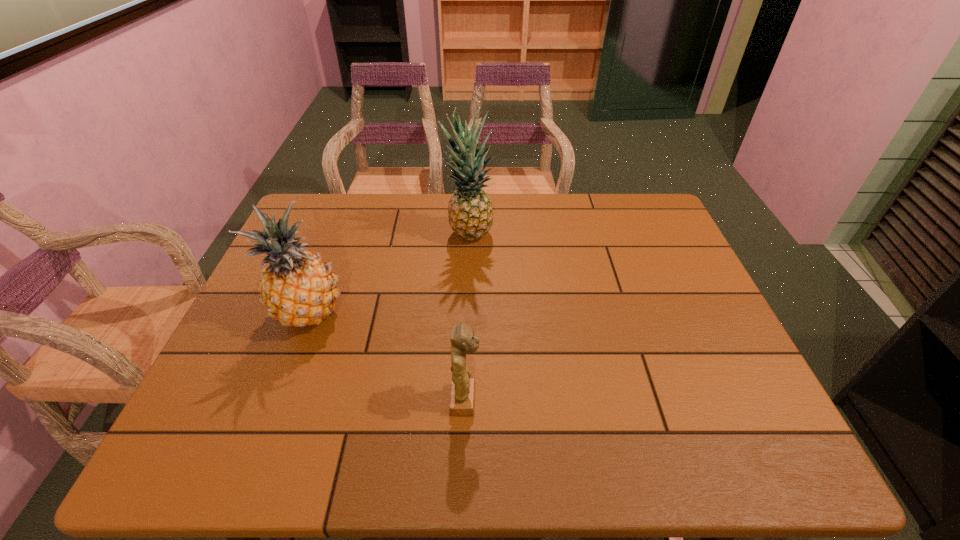
In order to click on free space between the left pineapple and the tallest object in this screenshot , I will do `click(388, 274)`.

Locate an element on the screen. This screenshot has height=540, width=960. free spot between the second nearest object and the nearest object is located at coordinates (386, 356).

Locate an element on the screen. vacant area that lies between the farthest object and the shorter pineapple is located at coordinates (388, 274).

Image resolution: width=960 pixels, height=540 pixels. Identify the location of free space between the right pineapple and the left pineapple. (388, 274).

I want to click on vacant space in between the nearer pineapple and the farther pineapple, so click(x=388, y=274).

Locate which object ranks second in proximity to the nearest object. Please provide its 2D coordinates. Your answer should be formatted as a tuple, i.e. [(x, y)], where the tuple contains the x and y coordinates of a point satisfying the conditions above.

[(470, 213)]

Locate which object is the second closest to the tallest object. Please provide its 2D coordinates. Your answer should be formatted as a tuple, i.e. [(x, y)], where the tuple contains the x and y coordinates of a point satisfying the conditions above.

[(462, 395)]